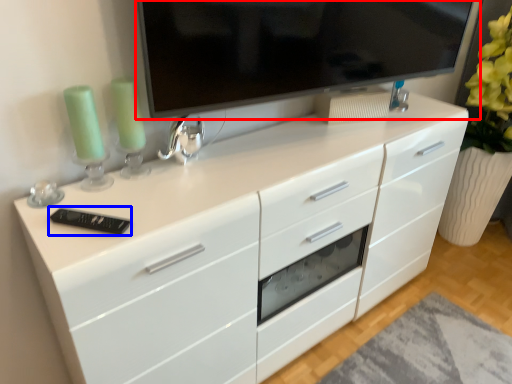
Question: Which of the following is the closest to the observer, television (highlighted by a red box) or appliance (highlighted by a blue box)?

Choices:
 (A) television
 (B) appliance

Answer: (A)